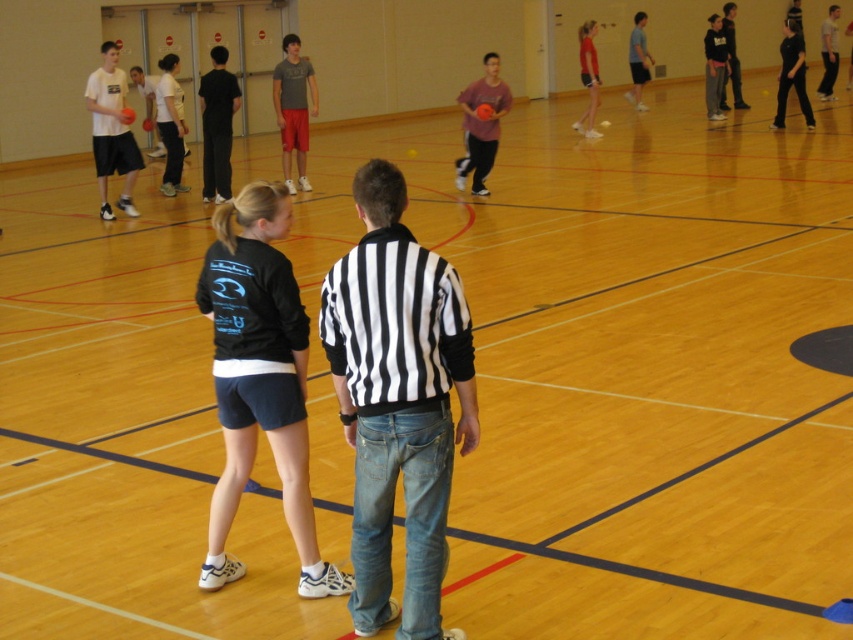
Question: Is the position of matte pink shirt at center less distant than that of black cotton hoodie at upper right?

Choices:
 (A) no
 (B) yes

Answer: (B)

Question: Which object is positioned farthest from the black cotton shirt at lower left?

Choices:
 (A) matte red shirt at upper right
 (B) light gray cotton t-shirt at upper right
 (C) matte gray t-shirt at center
 (D) matte white t-shirt at left

Answer: (B)

Question: Which of the following is the closest to the observer?

Choices:
 (A) black cotton shirt at lower left
 (B) matte pink shirt at center

Answer: (A)

Question: Can you confirm if matte pink shirt at center is positioned to the right of matte red shirt at upper right?

Choices:
 (A) no
 (B) yes

Answer: (A)

Question: Is black and white striped shirt at center positioned behind matte gray t-shirt at center?

Choices:
 (A) no
 (B) yes

Answer: (A)

Question: Considering the real-world distances, which object is farthest from the matte red shirt at upper right?

Choices:
 (A) black cotton hoodie at upper right
 (B) light gray cotton t-shirt at upper right
 (C) matte pink shirt at center

Answer: (B)